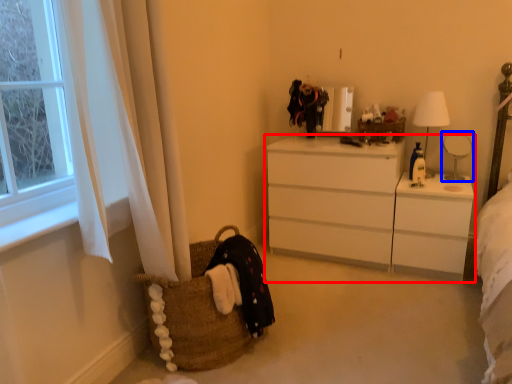
Question: Which object appears farthest to the camera in this image, chest of drawers (highlighted by a red box) or table lamp (highlighted by a blue box)?

Choices:
 (A) chest of drawers
 (B) table lamp

Answer: (B)